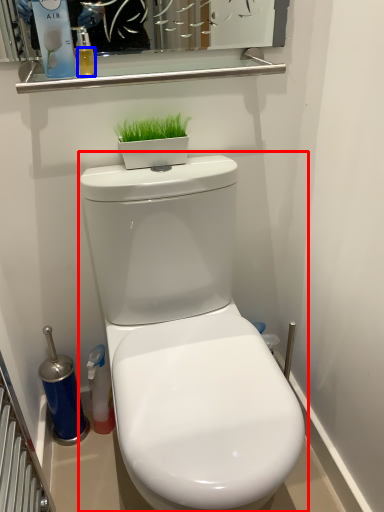
Question: Which object is further to the camera taking this photo, toilet (highlighted by a red box) or liquid (highlighted by a blue box)?

Choices:
 (A) toilet
 (B) liquid

Answer: (B)